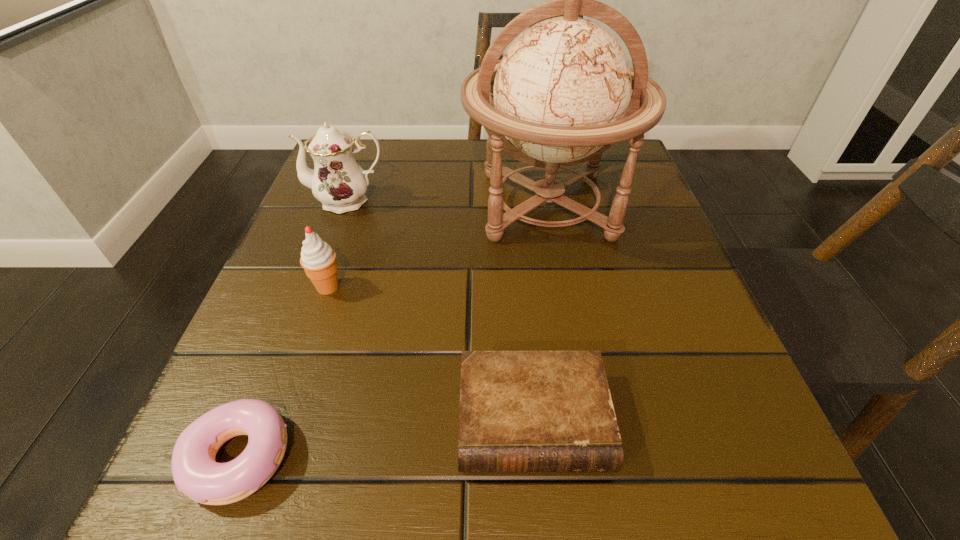
This screenshot has width=960, height=540. I want to click on globe present at the far edge, so click(561, 94).

I want to click on chinaware located in the far edge section of the desktop, so click(x=338, y=182).

Identify the location of diary that is at the near edge. (520, 411).

Locate an element on the screen. doughnut at the near edge is located at coordinates (195, 472).

Image resolution: width=960 pixels, height=540 pixels. I want to click on chinaware present at the left edge, so click(338, 182).

Where is `icecream located at the left edge`? The width and height of the screenshot is (960, 540). icecream located at the left edge is located at coordinates (318, 259).

I want to click on doughnut that is at the left edge, so click(195, 472).

The image size is (960, 540). What are the coordinates of `object situated at the right edge` in the screenshot? It's located at (561, 94).

Where is `object that is at the far left corner`? This screenshot has width=960, height=540. object that is at the far left corner is located at coordinates (338, 182).

Where is `object that is at the near left corner`? This screenshot has width=960, height=540. object that is at the near left corner is located at coordinates (195, 472).